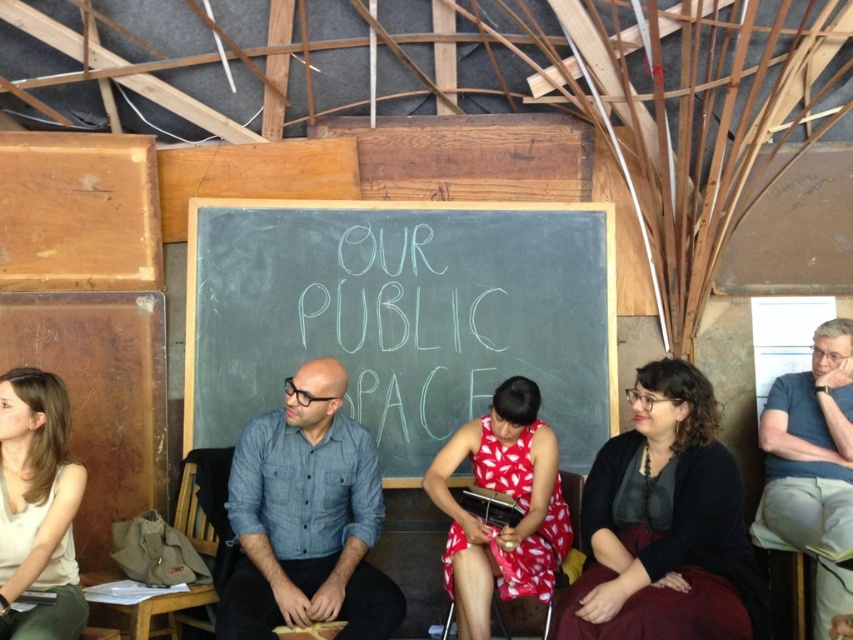
Between green chalkboard at center and dark gray sweater at center, which one has more height?

With more height is green chalkboard at center.

Does green chalkboard at center have a greater width compared to dark gray sweater at center?

Correct, the width of green chalkboard at center exceeds that of dark gray sweater at center.

Locate an element on the screen. The height and width of the screenshot is (640, 853). green chalkboard at center is located at coordinates (401, 316).

Can you confirm if denim shirt at center is positioned to the left of red printed dress at center?

Correct, you'll find denim shirt at center to the left of red printed dress at center.

Does denim shirt at center have a lesser width compared to red printed dress at center?

No.

Locate an element on the screen. Image resolution: width=853 pixels, height=640 pixels. denim shirt at center is located at coordinates (306, 518).

Is denim shirt at center positioned behind blue shirt at right?

No, denim shirt at center is in front of blue shirt at right.

At what (x,y) coordinates should I click in order to perform the action: click on denim shirt at center. Please return your answer as a coordinate pair (x, y). Looking at the image, I should click on (306, 518).